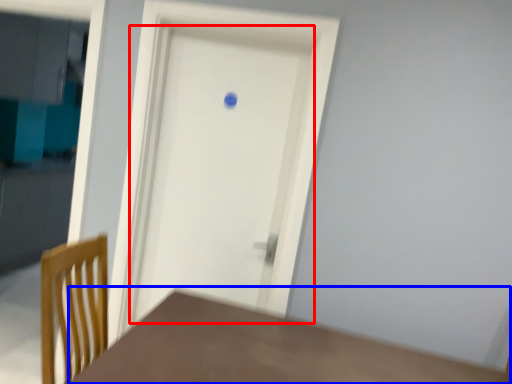
Question: Which point is closer to the camera, door (highlighted by a red box) or table (highlighted by a blue box)?

Choices:
 (A) door
 (B) table

Answer: (B)